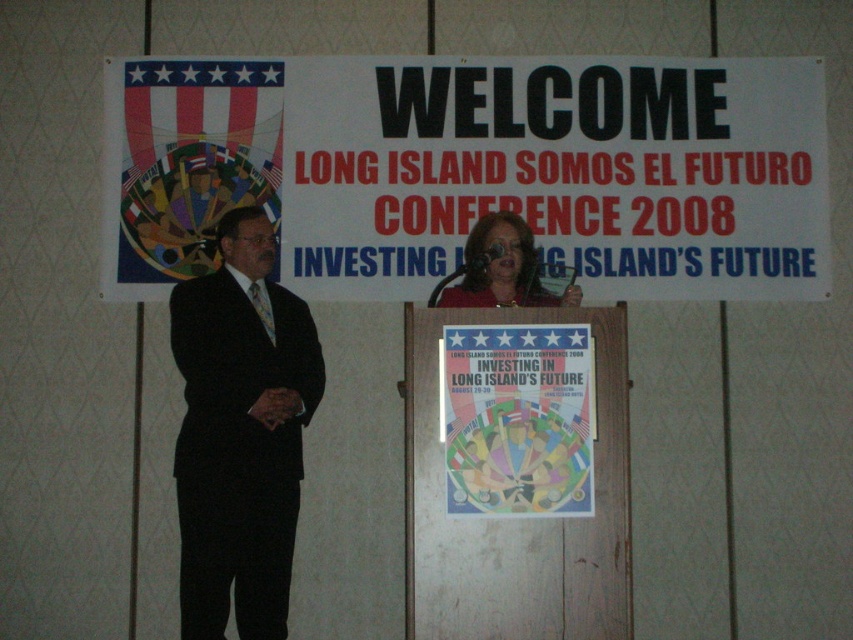
Consider the image. What is the location of the point with coordinates (241, 433) in the image?

The point with coordinates (241, 433) is located on the black suit at left.

You are an attendee at the Long Island Somos El Futuro Conference 2008. You notice two individuals in the front row wearing a black suit at left and a matte red blouse at center. From your seated position in the audience, which person is sitting closer to the podium?

The black suit at left is positioned under the matte red blouse at center, meaning the black suit at left is closer to the podium since it is directly beneath the other attendee.